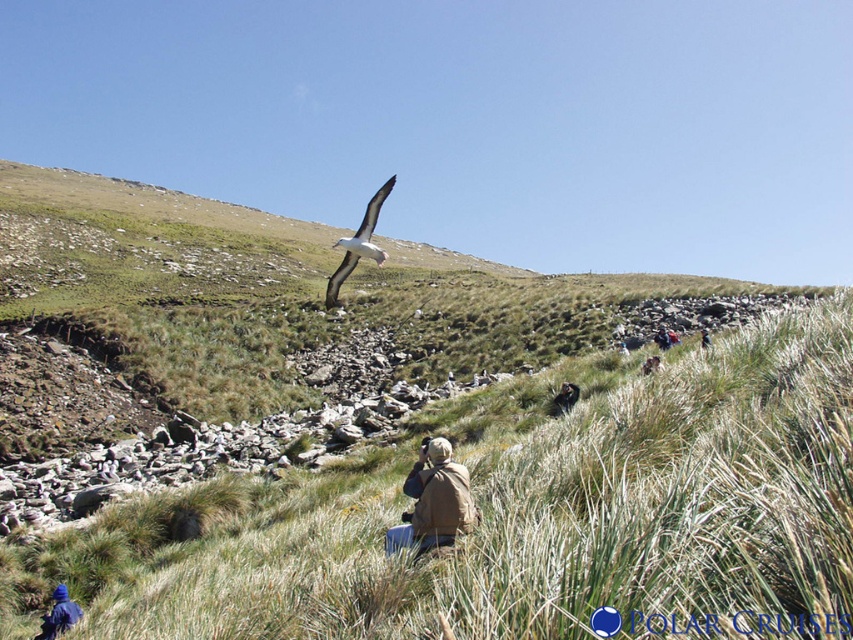
You are a photographer trying to capture a clear shot of the albatross in flight. You have two tripods available, one placed at the brown leather jacket at lower center and another at the brown leather jacket at center. Which tripod position is closer to the albatross?

The brown leather jacket at lower center is 5.72 meters away from the brown leather jacket at center, so the tripod at the brown leather jacket at lower center is closer to the albatross than the one at the brown leather jacket at center.